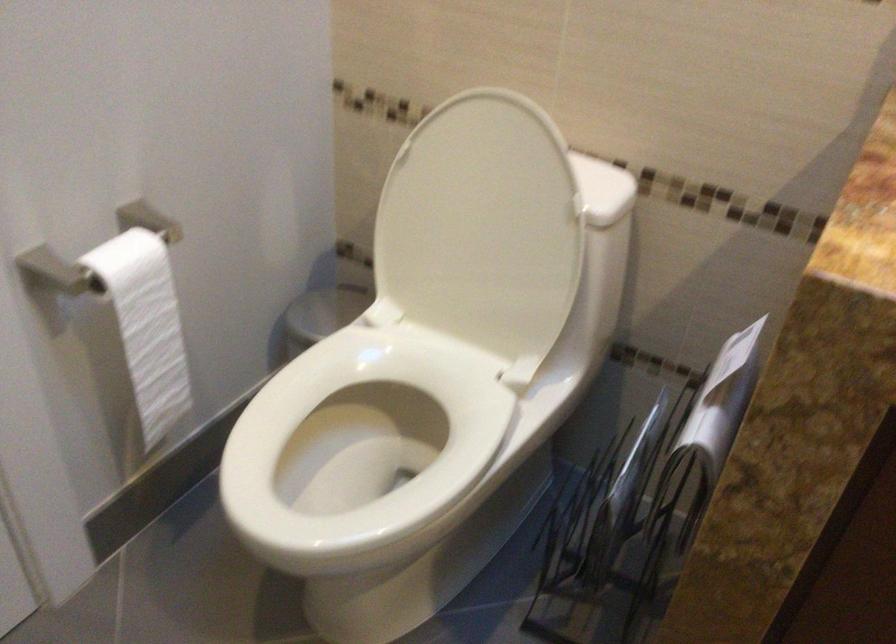
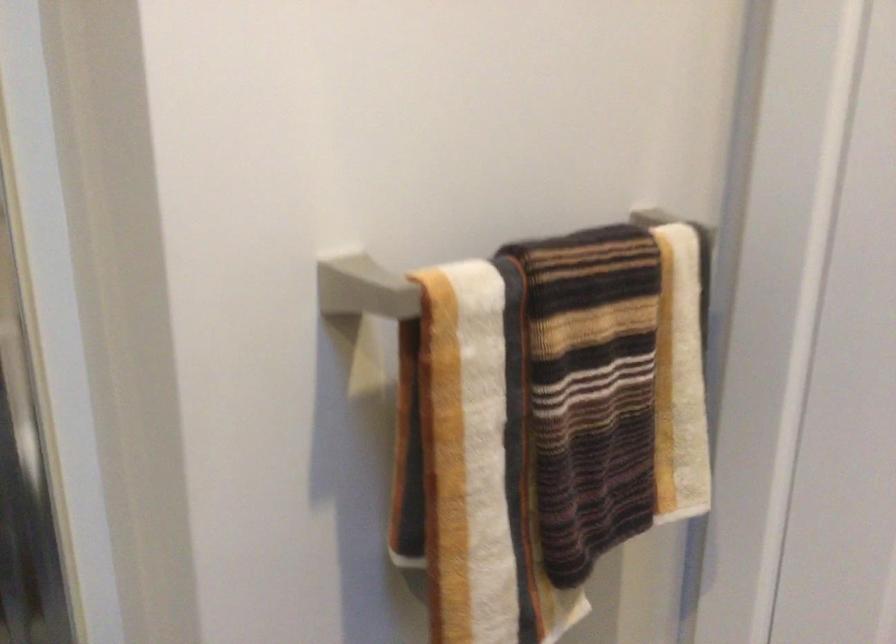
Looking at this image, how did the camera likely rotate?

The camera's rotation is toward left-down.